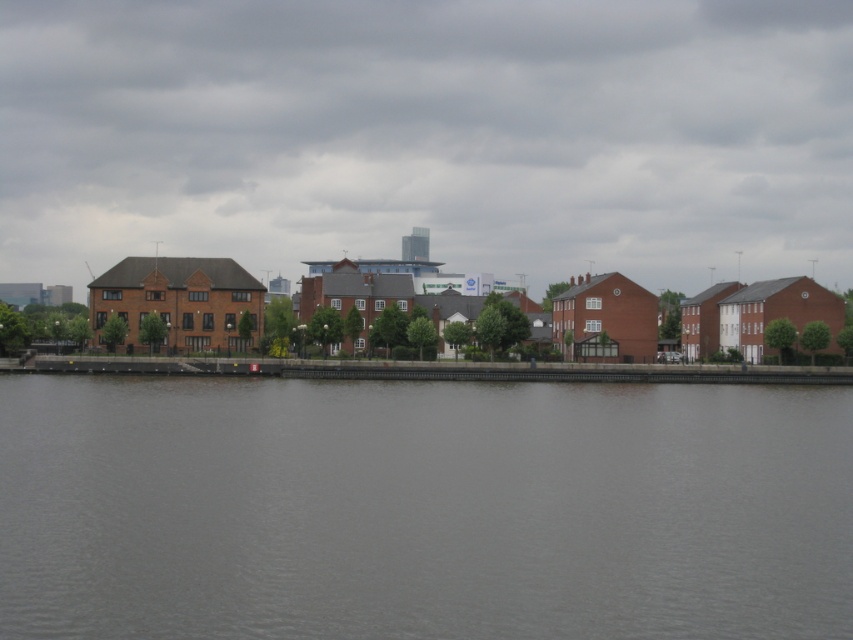
Is matte brick buildings at center taller than gray water at center?

Yes.

In order to click on matte brick buildings at center in this screenshot , I will do `click(428, 136)`.

What are the coordinates of `matte brick buildings at center` in the screenshot? It's located at (428, 136).